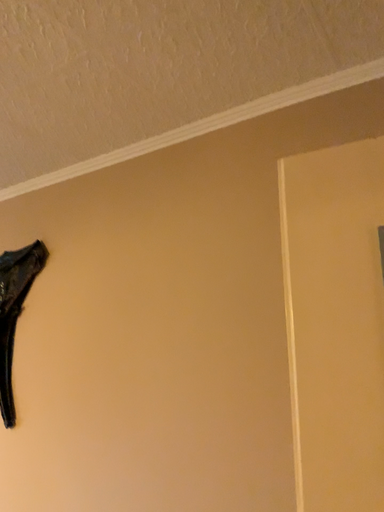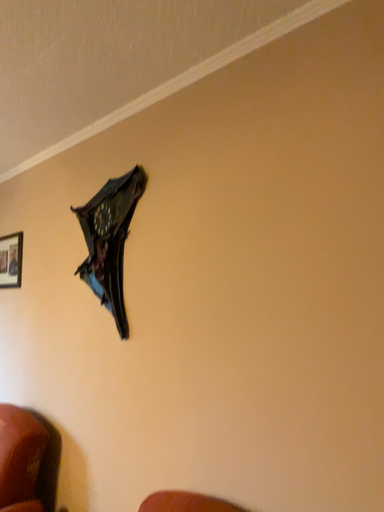
Question: Which way did the camera rotate in the video?

Choices:
 (A) rotated downward
 (B) rotated upward

Answer: (A)